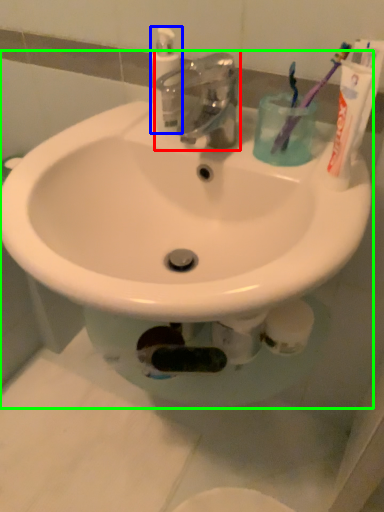
Question: Based on their relative distances, which object is farther from tap (highlighted by a red box)? Choose from cleaning product (highlighted by a blue box) and sink (highlighted by a green box).

Choices:
 (A) cleaning product
 (B) sink

Answer: (B)